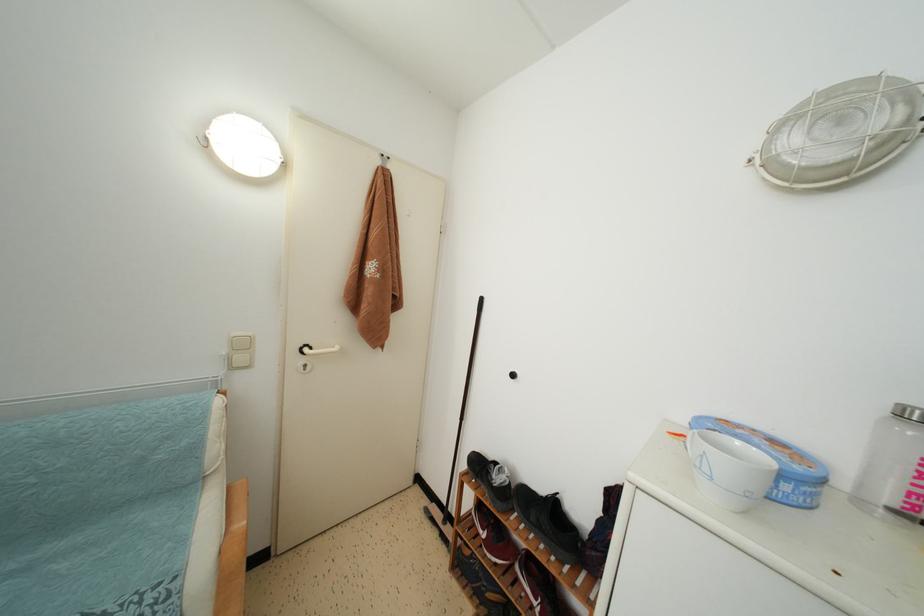
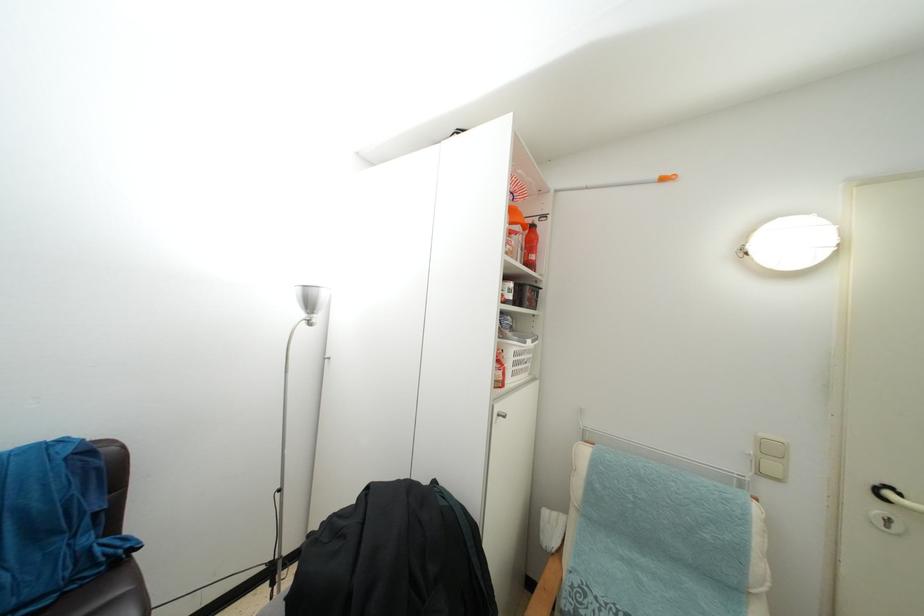
Question: How did the camera likely rotate?

Choices:
 (A) Left
 (B) Right
 (C) Up
 (D) Down

Answer: (A)